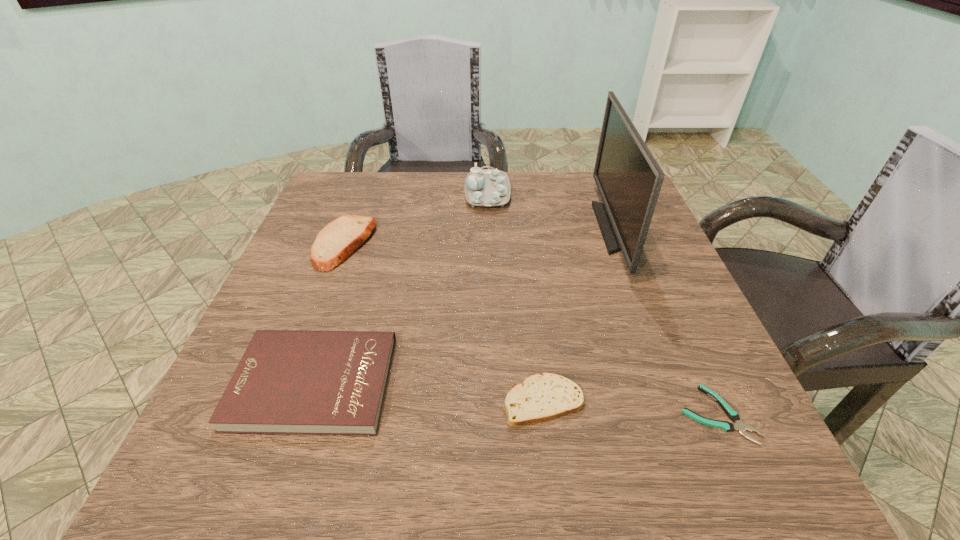
Locate an element on the screen. This screenshot has width=960, height=540. vacant space in between the left pita bread and the second shortest object is located at coordinates (444, 322).

You are a GUI agent. You are given a task and a screenshot of the screen. Output one action in this format:
    pyautogui.click(x=<x>, y=<y>)
    Task: Click on the vacant point located between the tallest object and the shorter pita bread
    The height and width of the screenshot is (540, 960).
    Given the screenshot: What is the action you would take?
    pyautogui.click(x=580, y=315)

Where is `unoccupied area between the shorter pita bread and the tallest object`? This screenshot has width=960, height=540. unoccupied area between the shorter pita bread and the tallest object is located at coordinates (580, 315).

Locate an element on the screen. free space between the second tallest object and the left pita bread is located at coordinates (416, 218).

Locate an element on the screen. vacant area that lies between the nearer pita bread and the hardback book is located at coordinates (429, 392).

Image resolution: width=960 pixels, height=540 pixels. What are the coordinates of `object that ranks as the fifth closest to the taller pita bread` in the screenshot? It's located at (733, 415).

This screenshot has width=960, height=540. I want to click on the third closest object relative to the tallest object, so click(x=538, y=398).

At what (x,y) coordinates should I click in order to perform the action: click on vacant area that satisfies the following two spatial constraints: 1. on the front side of the shorter pita bread; 2. on the left side of the left pita bread. Please return your answer as a coordinate pair (x, y). Looking at the image, I should click on (286, 401).